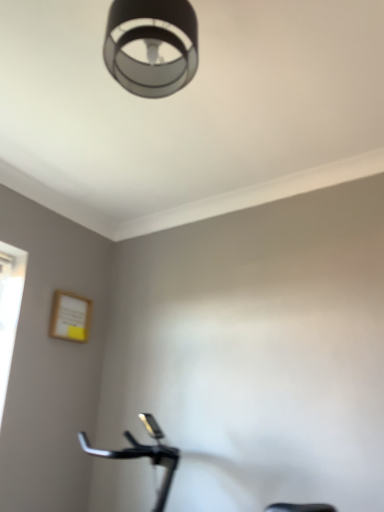
Question: Is matte black lampshade at upper center beside black matte stationary bicycle at lower center?

Choices:
 (A) yes
 (B) no

Answer: (B)

Question: From the image's perspective, is matte black lampshade at upper center on top of black matte stationary bicycle at lower center?

Choices:
 (A) yes
 (B) no

Answer: (A)

Question: Considering the relative sizes of matte black lampshade at upper center and black matte stationary bicycle at lower center in the image provided, is matte black lampshade at upper center taller than black matte stationary bicycle at lower center?

Choices:
 (A) yes
 (B) no

Answer: (B)

Question: Is matte black lampshade at upper center looking in the opposite direction of black matte stationary bicycle at lower center?

Choices:
 (A) no
 (B) yes

Answer: (A)

Question: Is matte black lampshade at upper center to the right of black matte stationary bicycle at lower center from the viewer's perspective?

Choices:
 (A) yes
 (B) no

Answer: (B)

Question: Does matte black lampshade at upper center have a greater width compared to black matte stationary bicycle at lower center?

Choices:
 (A) yes
 (B) no

Answer: (B)

Question: Is the position of black matte stationary bicycle at lower center less distant than that of matte black lampshade at upper center?

Choices:
 (A) yes
 (B) no

Answer: (B)

Question: From a real-world perspective, is black matte stationary bicycle at lower center over matte black lampshade at upper center?

Choices:
 (A) yes
 (B) no

Answer: (B)

Question: Is matte black lampshade at upper center surrounded by black matte stationary bicycle at lower center?

Choices:
 (A) yes
 (B) no

Answer: (B)

Question: Are black matte stationary bicycle at lower center and matte black lampshade at upper center located far from each other?

Choices:
 (A) no
 (B) yes

Answer: (B)

Question: Can you confirm if black matte stationary bicycle at lower center is shorter than matte black lampshade at upper center?

Choices:
 (A) no
 (B) yes

Answer: (A)

Question: Can you confirm if black matte stationary bicycle at lower center is thinner than matte black lampshade at upper center?

Choices:
 (A) no
 (B) yes

Answer: (A)

Question: Is point (144, 32) positioned closer to the camera than point (145, 418)?

Choices:
 (A) farther
 (B) closer

Answer: (B)